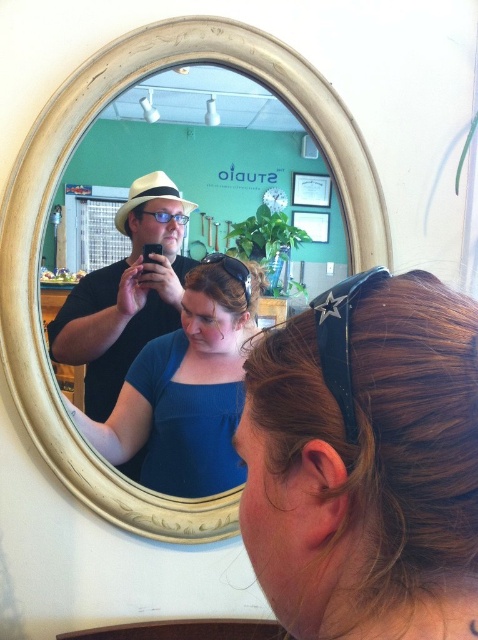
Question: Which object is closer to the camera taking this photo?

Choices:
 (A) blue matte shirt at center
 (B) matte black hat at left
 (C) brown hair at center

Answer: (C)

Question: Does brown hair at center appear on the right side of blue matte shirt at center?

Choices:
 (A) no
 (B) yes

Answer: (B)

Question: Considering the real-world distances, which object is farthest from the blue matte shirt at center?

Choices:
 (A) brown matte hair at center
 (B) white wooden mirror at upper center
 (C) brown hair at center
 (D) matte black hat at left

Answer: (C)

Question: Does brown hair at center come behind blue matte shirt at center?

Choices:
 (A) no
 (B) yes

Answer: (A)

Question: Which point is closer to the camera taking this photo?

Choices:
 (A) (252, 273)
 (B) (97, 298)
 (C) (97, 285)

Answer: (B)

Question: Does blue matte shirt at center appear on the right side of brown matte hair at center?

Choices:
 (A) no
 (B) yes

Answer: (A)